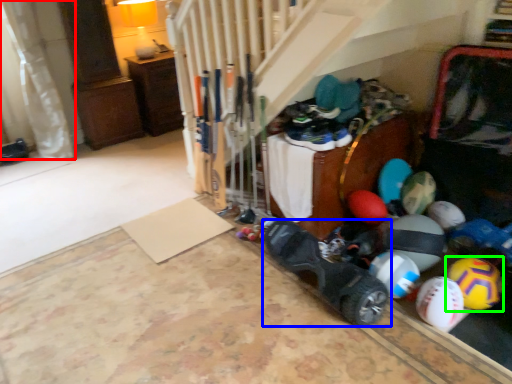
Question: Which is farther away from curtain (highlighted by a red box)? footwear (highlighted by a blue box) or beach ball (highlighted by a green box)?

Choices:
 (A) footwear
 (B) beach ball

Answer: (B)